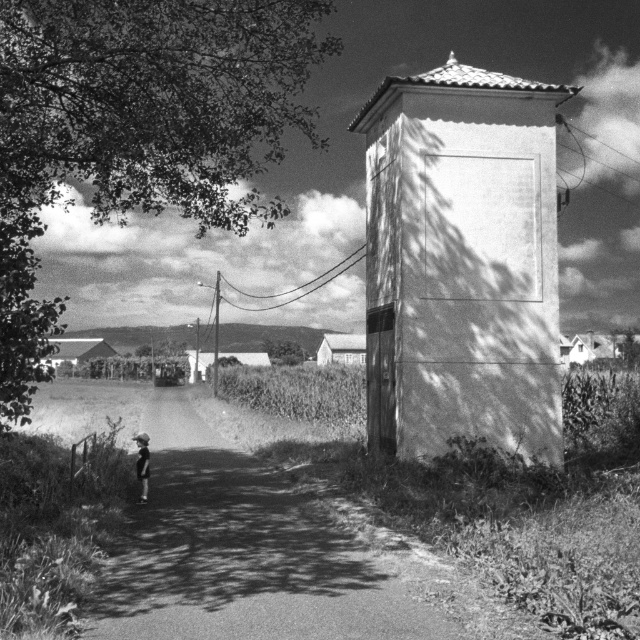
Who is shorter, smooth concrete water tower at center or dirt road at center?

Standing shorter between the two is dirt road at center.

How far apart are smooth concrete water tower at center and dirt road at center?

The distance of smooth concrete water tower at center from dirt road at center is 5.28 meters.

Locate an element on the screen. Image resolution: width=640 pixels, height=640 pixels. smooth concrete water tower at center is located at coordinates (461, 262).

Find the location of a particular element. The width and height of the screenshot is (640, 640). smooth concrete water tower at center is located at coordinates tap(461, 262).

Does dark green leafy tree at upper left lie in front of dirt road at center?

No, it is not.

Who is higher up, dark green leafy tree at upper left or dirt road at center?

dark green leafy tree at upper left

Which is in front, point (19, 260) or point (104, 573)?

Point (104, 573) is more forward.

Find the location of a particular element. This screenshot has height=640, width=640. dark green leafy tree at upper left is located at coordinates (138, 129).

Can you confirm if dark green leafy tree at upper left is positioned above smooth concrete water tower at center?

Yes.

Who is more forward, (237, 216) or (387, 410)?

Point (387, 410) is in front.

This screenshot has width=640, height=640. Find the location of `dark green leafy tree at upper left`. dark green leafy tree at upper left is located at coordinates (138, 129).